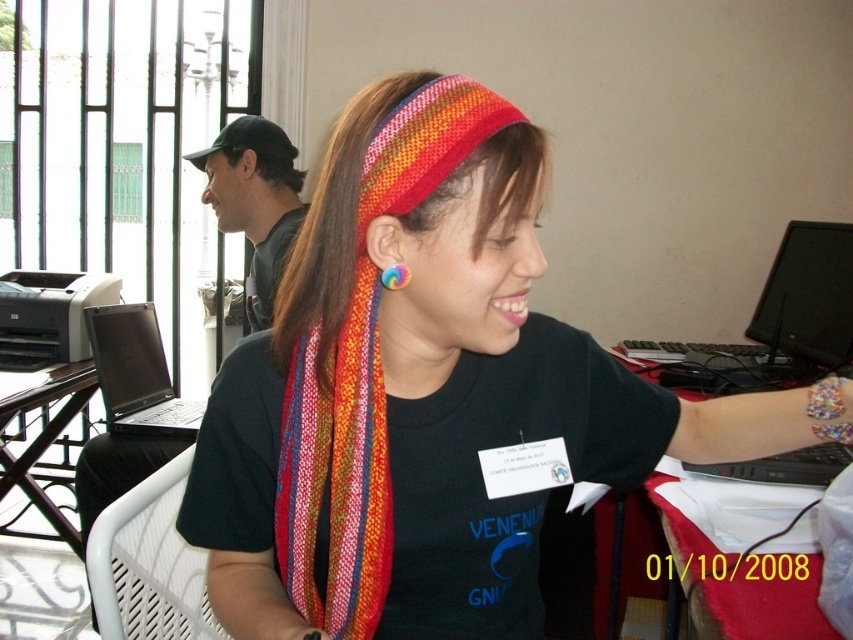
Is knitted fabric headband at center taller than black glossy laptop at left?

Indeed, knitted fabric headband at center has a greater height compared to black glossy laptop at left.

In the scene shown: Between knitted fabric headband at center and black glossy laptop at left, which one has more height?

knitted fabric headband at center is taller.

The image size is (853, 640). What are the coordinates of `knitted fabric headband at center` in the screenshot? It's located at (428, 392).

Between red cloth at right and rainbow fabric earring at ear, which one is positioned higher?

rainbow fabric earring at ear is higher up.

Is point (608, 515) farther from viewer compared to point (409, 280)?

Yes, it is.

This screenshot has width=853, height=640. Identify the location of red cloth at right. (770, 611).

Does knitted fabric headband at center appear on the left side of brown matte hair at upper left?

Incorrect, knitted fabric headband at center is not on the left side of brown matte hair at upper left.

Between knitted fabric headband at center and brown matte hair at upper left, which one is positioned higher?

brown matte hair at upper left is higher up.

Is point (654, 429) closer to camera compared to point (265, 156)?

Yes, it is.

Find the location of `knitted fabric headband at center`. knitted fabric headband at center is located at coordinates (428, 392).